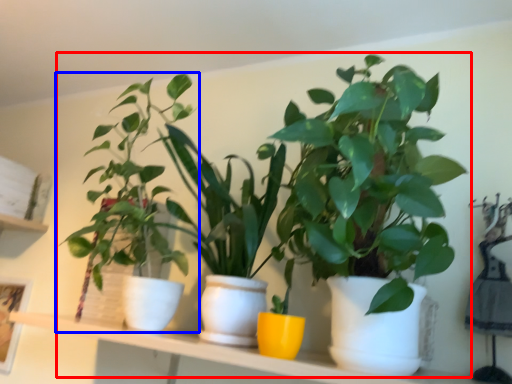
Question: Which point is closer to the camera, houseplant (highlighted by a red box) or houseplant (highlighted by a blue box)?

Choices:
 (A) houseplant
 (B) houseplant

Answer: (A)